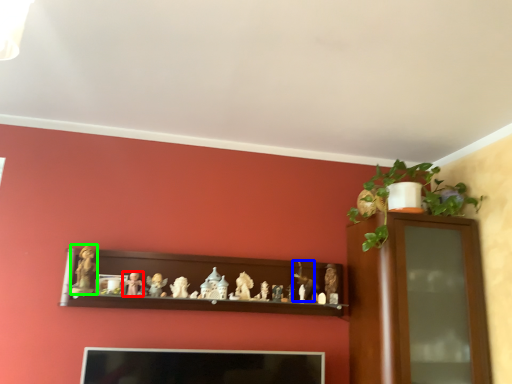
Question: Estimate the real-world distances between objects in this image. Which object is farther from toy (highlighted by a red box), toy (highlighted by a blue box) or toy (highlighted by a green box)?

Choices:
 (A) toy
 (B) toy

Answer: (A)